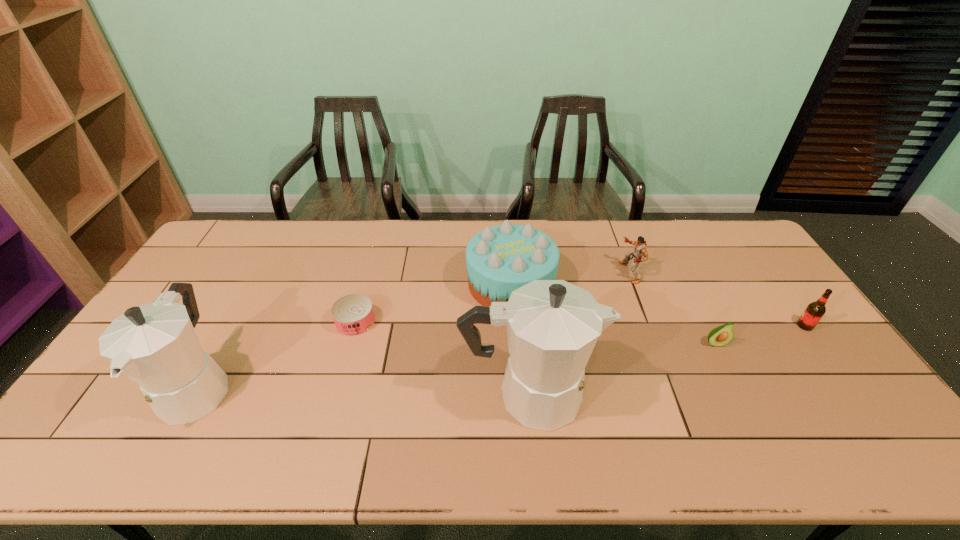
All coffeepots are currently evenly spaced. To continue this pattern, where would you add another coffeepot on the right? Please point out a vacant spot. Please provide its 2D coordinates. Your answer should be formatted as a tuple, i.e. [(x, y)], where the tuple contains the x and y coordinates of a point satisfying the conditions above.

[(870, 403)]